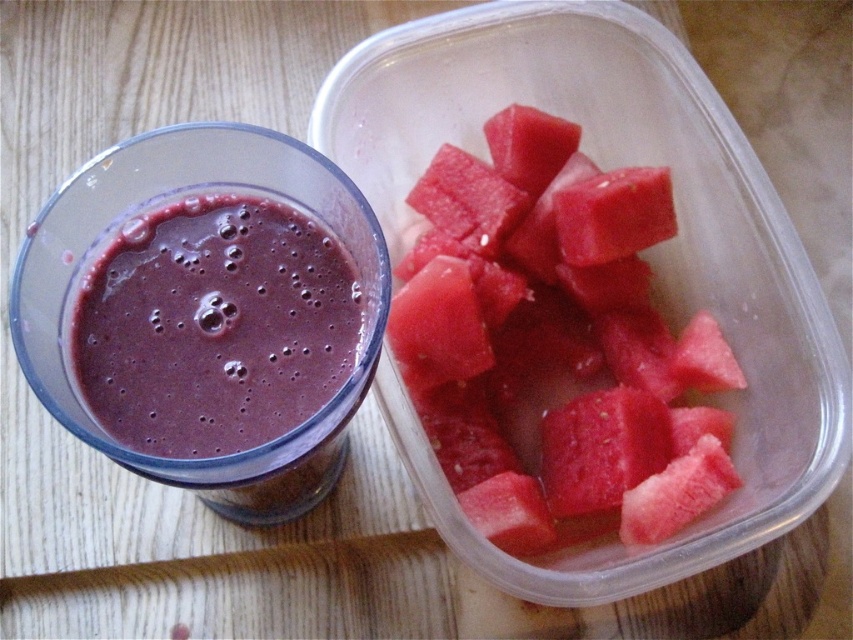
Is red matte watermelon at upper right thinner than purple smoothie at left?

In fact, red matte watermelon at upper right might be wider than purple smoothie at left.

Does point (514, 252) lie behind point (247, 301)?

Yes, it is.

Does point (515, 288) come farther from viewer compared to point (315, 353)?

Yes, point (515, 288) is farther from viewer.

The width and height of the screenshot is (853, 640). Identify the location of red matte watermelon at upper right. (556, 342).